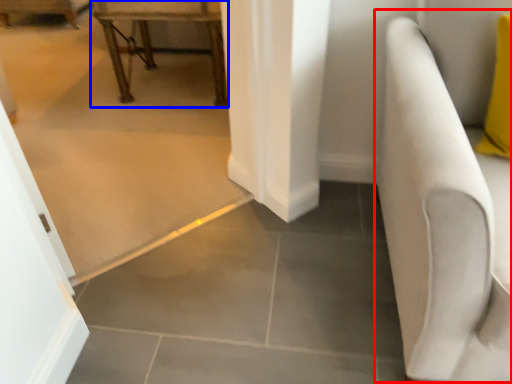
Question: Which object appears closest to the camera in this image, armchair (highlighted by a red box) or furniture (highlighted by a blue box)?

Choices:
 (A) armchair
 (B) furniture

Answer: (A)